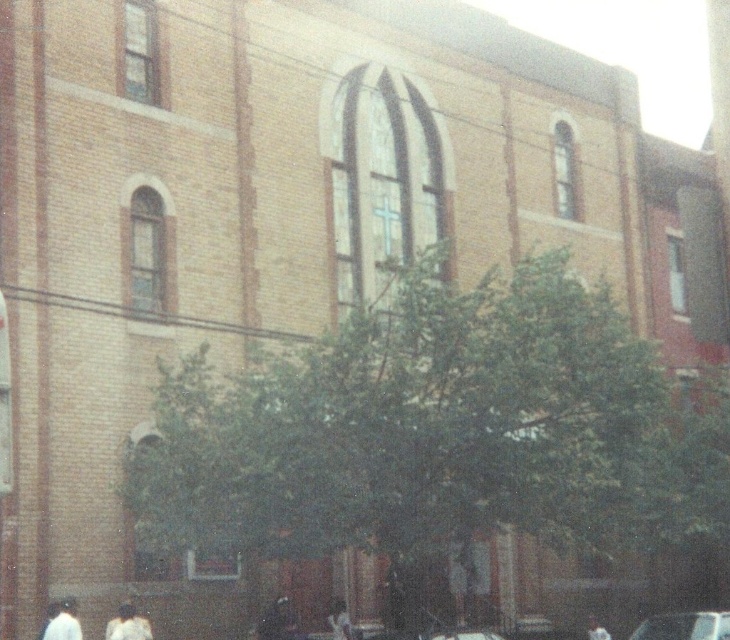
Question: Can you confirm if shiny silver car at lower right is bigger than white matte person at lower left?

Choices:
 (A) yes
 (B) no

Answer: (A)

Question: Which object is farther from the camera taking this photo?

Choices:
 (A) light brown hair at lower right
 (B) white matte shirt at lower left

Answer: (A)

Question: Can you confirm if dark hair at lower center is smaller than white matte shirt at lower left?

Choices:
 (A) no
 (B) yes

Answer: (A)

Question: Which of the following is the farthest from the observer?

Choices:
 (A) white matte shirt at lower left
 (B) dark hair at lower center
 (C) white matte person at lower center

Answer: (C)

Question: Is white matte person at lower center wider than light brown hair at lower right?

Choices:
 (A) yes
 (B) no

Answer: (B)

Question: Which point is farther from the camera taking this photo?

Choices:
 (A) (126, 625)
 (B) (726, 627)
 (C) (293, 632)

Answer: (C)